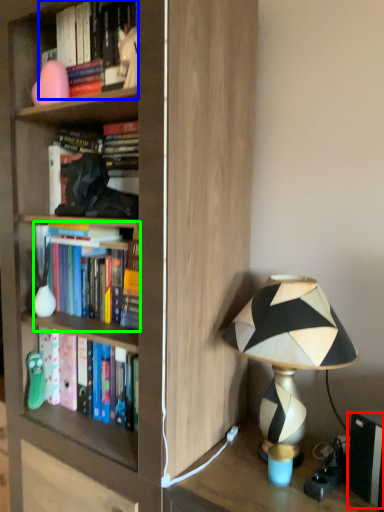
Question: Considering the real-world distances, which object is closest to paperback book (highlighted by a red box)? book (highlighted by a blue box) or book (highlighted by a green box).

Choices:
 (A) book
 (B) book

Answer: (B)